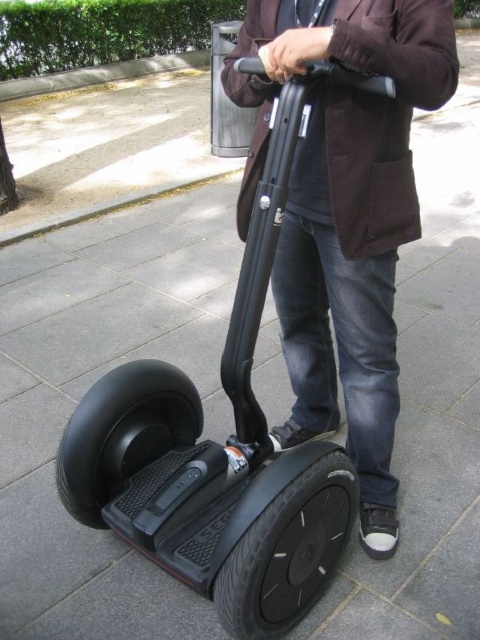
Is dark brown leather jacket at center positioned before black rubber scooter at center?

Yes, dark brown leather jacket at center is closer to the viewer.

Does dark brown leather jacket at center have a smaller size compared to black rubber scooter at center?

No, dark brown leather jacket at center is not smaller than black rubber scooter at center.

Find the location of a particular element. Image resolution: width=480 pixels, height=640 pixels. dark brown leather jacket at center is located at coordinates (345, 216).

Find the location of a particular element. This screenshot has height=640, width=480. dark brown leather jacket at center is located at coordinates (345, 216).